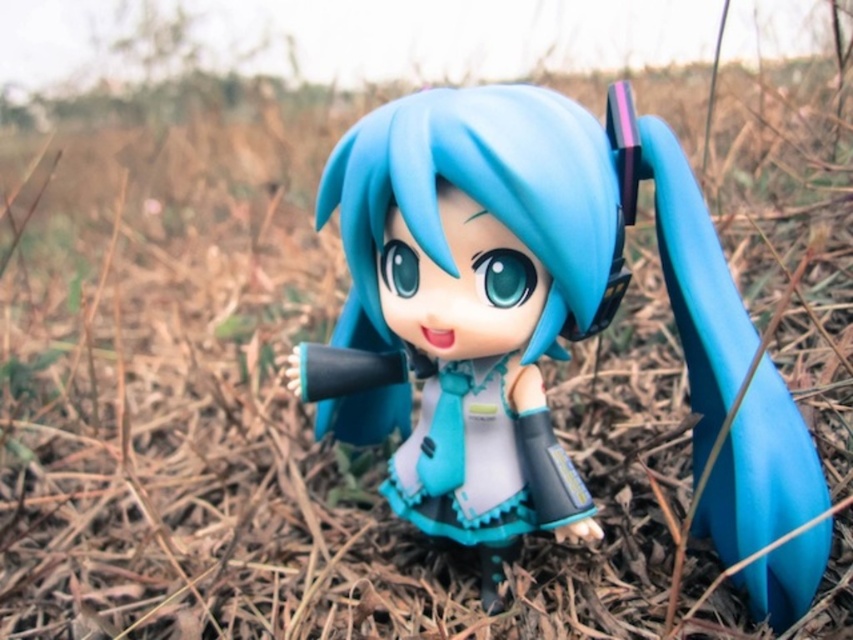
Between matte plastic toy at center and semi-glossy blue hair at center, which one is positioned higher?

semi-glossy blue hair at center is higher up.

Is matte plastic toy at center to the left of semi-glossy blue hair at center from the viewer's perspective?

In fact, matte plastic toy at center is to the right of semi-glossy blue hair at center.

Does point (392, 336) come in front of point (561, 182)?

That is False.

You are a GUI agent. You are given a task and a screenshot of the screen. Output one action in this format:
    pyautogui.click(x=<x>, y=<y>)
    Task: Click on the matte plastic toy at center
    
    Given the screenshot: What is the action you would take?
    pyautogui.click(x=473, y=300)